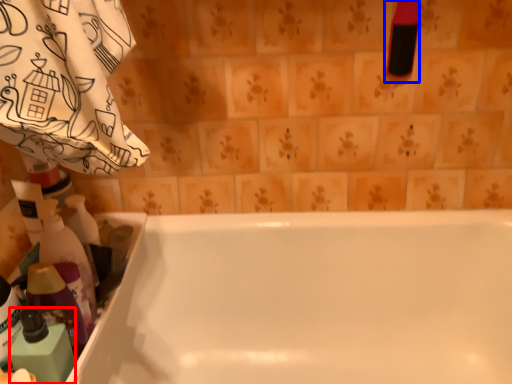
Question: Which point is further to the camera, cleaning product (highlighted by a red box) or cleaning product (highlighted by a blue box)?

Choices:
 (A) cleaning product
 (B) cleaning product

Answer: (B)